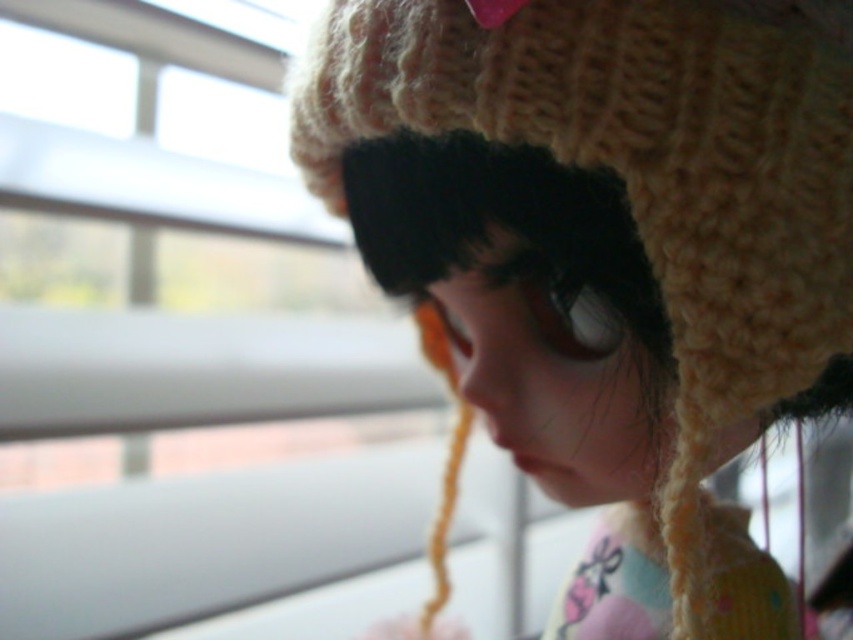
Looking at this image, you are trying to decide whether to place a small potted plant between the transparent glass window at upper left and the knitted woolen hat at upper right. Based on their sizes, will the plant fit comfortably without overcrowding the space?

The transparent glass window at upper left is larger than the knitted woolen hat at upper right. Since the plant is small, it should fit comfortably between them without overcrowding the space.